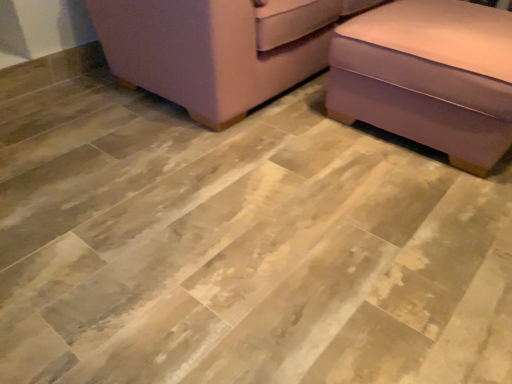
Question: From the image's perspective, is pink fabric couch at upper right, positioned as the first furniture in left-to-right order, positioned above or below purple fabric ottoman at lower right, the first furniture positioned from the right?

Choices:
 (A) below
 (B) above

Answer: (B)

Question: Looking at the image, does pink fabric couch at upper right, which appears as the second furniture when viewed from the right, seem bigger or smaller compared to purple fabric ottoman at lower right, the first furniture positioned from the right?

Choices:
 (A) small
 (B) big

Answer: (B)

Question: Is point (307, 19) positioned closer to the camera than point (442, 16)?

Choices:
 (A) farther
 (B) closer

Answer: (A)

Question: Looking at their shapes, would you say purple fabric ottoman at lower right, arranged as the second furniture when viewed from the left, is wider or thinner than pink fabric couch at upper right, which appears as the second furniture when viewed from the right?

Choices:
 (A) wide
 (B) thin

Answer: (B)

Question: Does point (329, 102) appear closer or farther from the camera than point (209, 1)?

Choices:
 (A) farther
 (B) closer

Answer: (A)

Question: From the image's perspective, is purple fabric ottoman at lower right, arranged as the second furniture when viewed from the left, positioned above or below pink fabric couch at upper right, positioned as the first furniture in left-to-right order?

Choices:
 (A) above
 (B) below

Answer: (B)

Question: From a real-world perspective, relative to pink fabric couch at upper right, positioned as the first furniture in left-to-right order, is purple fabric ottoman at lower right, the first furniture positioned from the right, vertically above or below?

Choices:
 (A) below
 (B) above

Answer: (A)